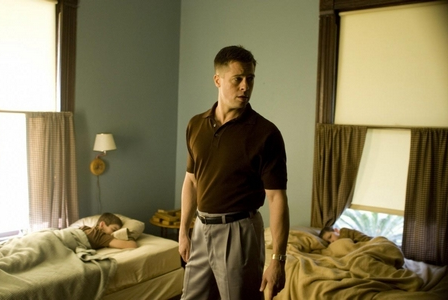
The image size is (448, 300). I want to click on windows, so click(x=20, y=48), click(x=12, y=169), click(x=374, y=222).